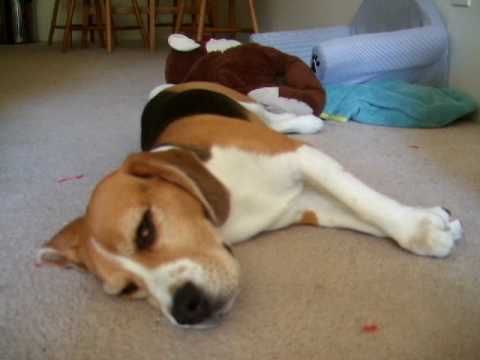
The width and height of the screenshot is (480, 360). Find the location of `back wall`. back wall is located at coordinates (306, 17), (43, 15).